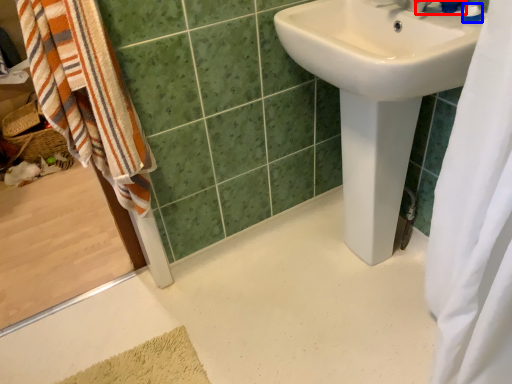
Question: Which point is closer to the camera, plumbing fixture (highlighted by a red box) or toiletry (highlighted by a blue box)?

Choices:
 (A) plumbing fixture
 (B) toiletry

Answer: (A)